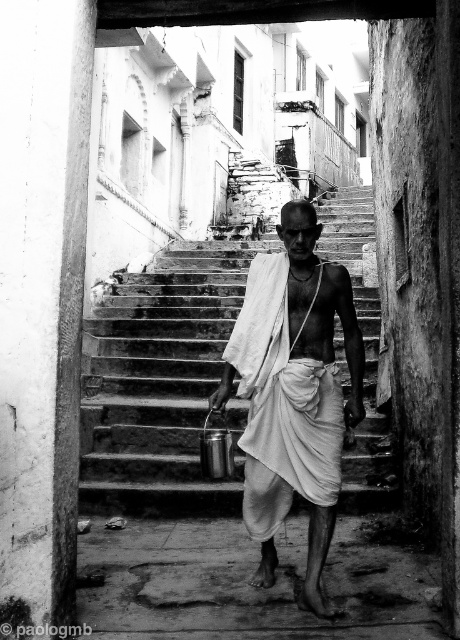
You are standing at the bottom of the stone stairs at center in the image. There is a point marked at coordinates (x=161, y=384). Can you tell me where this point is located relative to your current position?

The point at (x=161, y=384) is located on the stone stairs at center, so it is above your current position at the bottom of the stairs.

Based on the scene, if the white clothed man at center wants to climb up the stone stairs at center, would he need to bend his head to avoid hitting it against the staircase structure?

The stone stairs at center is much taller than the white clothed man at center, so he would need to bend his head to avoid hitting it against the staircase structure.

You are a photographer trying to capture the white clothed man at center as he walks down the stone stairs at center. Since the stairs are positioned over him, will you need to adjust your camera angle to see his feet?

The stone stairs at center is positioned over white clothed man at center, so the stairs are blocking the view of his feet. To capture his feet, you need to lower your camera angle to see below the stairs.